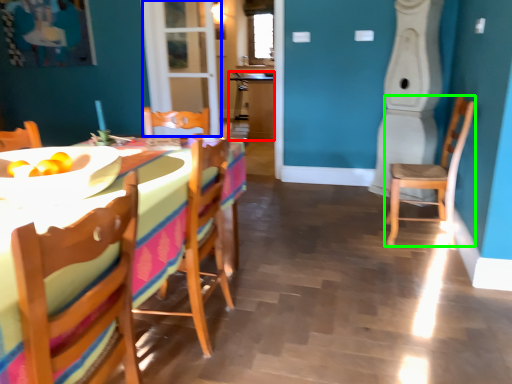
Question: Considering the real-world distances, which object is farthest from table (highlighted by a red box)? glass door (highlighted by a blue box) or chair (highlighted by a green box)?

Choices:
 (A) glass door
 (B) chair

Answer: (B)